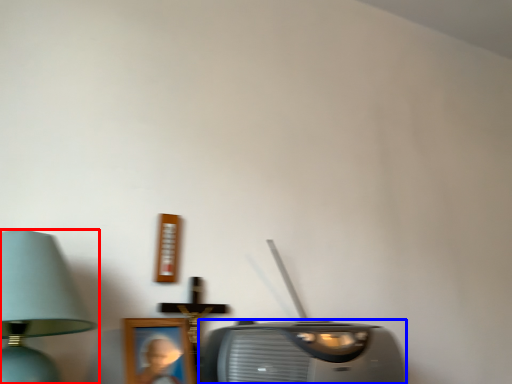
Question: Which of the following is the closest to the observer, lamp (highlighted by a red box) or stereo (highlighted by a blue box)?

Choices:
 (A) lamp
 (B) stereo

Answer: (A)